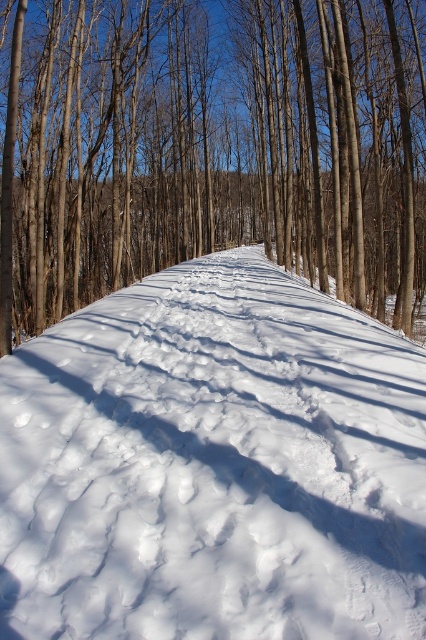
Question: From the image, what is the correct spatial relationship of white fluffy snow at center in relation to brown smooth tree at center?

Choices:
 (A) below
 (B) above

Answer: (A)

Question: Can you confirm if white fluffy snow at center is thinner than brown smooth tree at center?

Choices:
 (A) no
 (B) yes

Answer: (B)

Question: Which point is closer to the camera taking this photo?

Choices:
 (A) (112, 260)
 (B) (417, 467)

Answer: (B)

Question: Does white fluffy snow at center have a lesser width compared to brown smooth tree at center?

Choices:
 (A) yes
 (B) no

Answer: (A)

Question: Among these points, which one is farthest from the camera?

Choices:
 (A) (143, 493)
 (B) (46, 48)

Answer: (B)

Question: Which object appears farthest from the camera in this image?

Choices:
 (A) brown smooth tree at center
 (B) white fluffy snow at center

Answer: (A)